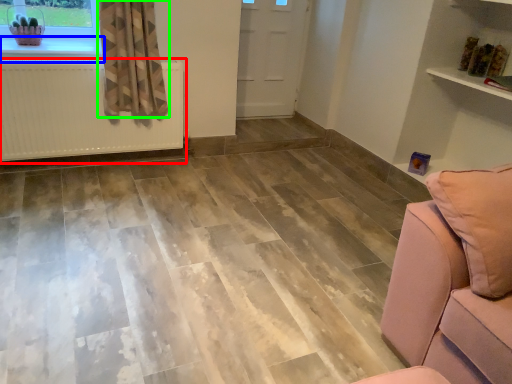
Question: Based on their relative distances, which object is farther from radiator (highlighted by a red box)? Choose from window sill (highlighted by a blue box) and curtain (highlighted by a green box).

Choices:
 (A) window sill
 (B) curtain

Answer: (A)